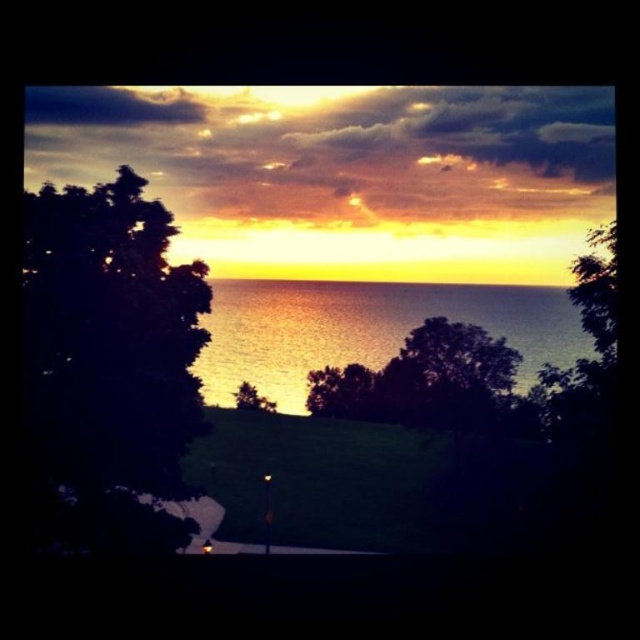
In the scene shown: You are standing in the foreground of the sunset scene and want to take a photo. Which tree, the dark green leafy tree at left or the green leafy tree at center, is positioned higher in the frame to better capture its silhouette against the sunset sky?

The dark green leafy tree at left is positioned higher in the frame than the green leafy tree at center, making it better for capturing its silhouette against the sunset sky.

You are standing in the sunset scene and want to take a photo of both the dark green leafy tree at left and the green leafy tree at center. Which tree should you focus on first to ensure both are in sharp focus?

You should focus on the dark green leafy tree at left first because it is closer to you than the green leafy tree at center. By focusing on the closer tree, the farther one will also be in focus due to the depth of field.

In the scene shown: You are standing in the sunset scene and notice the shiny metallic water at center and the green leafy tree at center. Which object is closer to you?

The shiny metallic water at center is closer to you because it is in front of the green leafy tree at center.